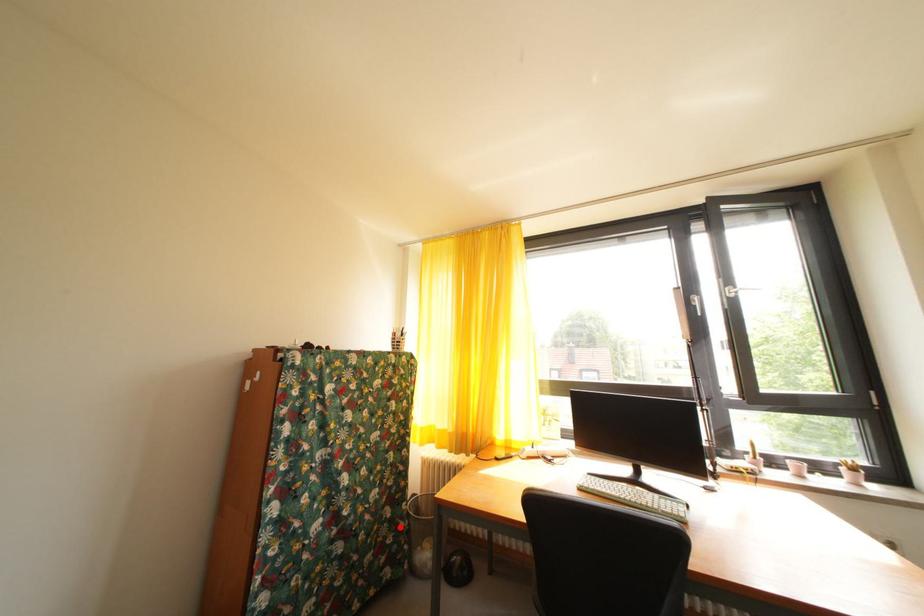
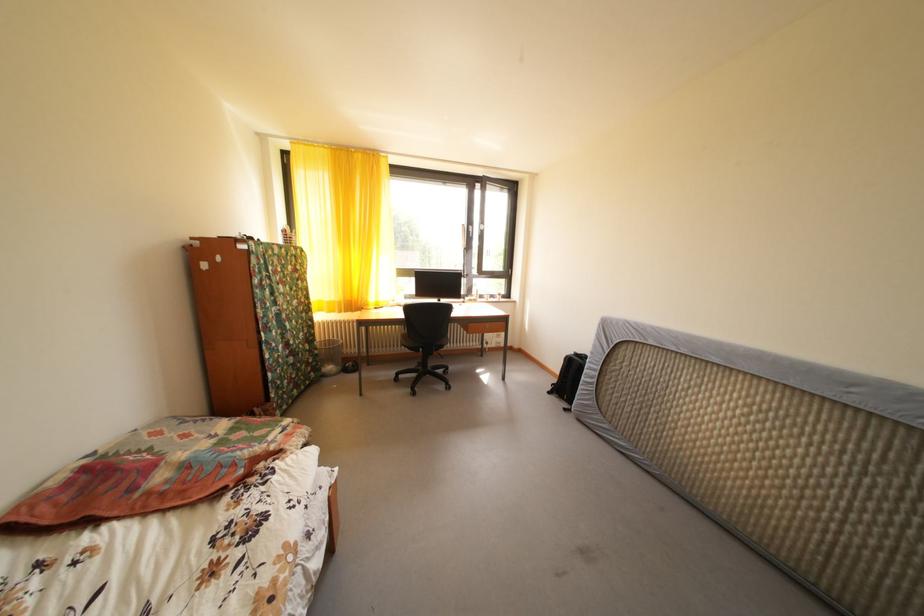
Locate, in the second image, the point that corresponds to the highlighted location in the first image.

(320, 357)